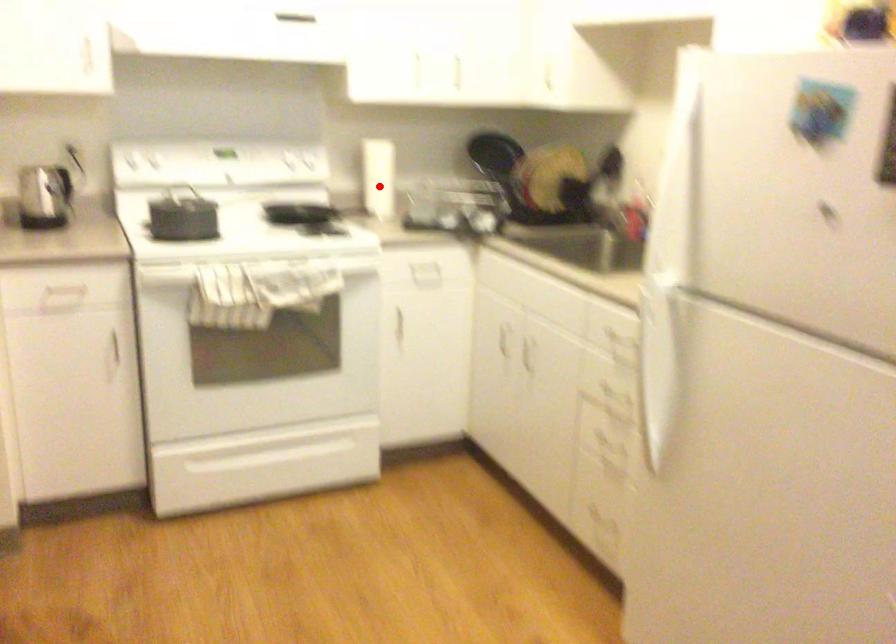
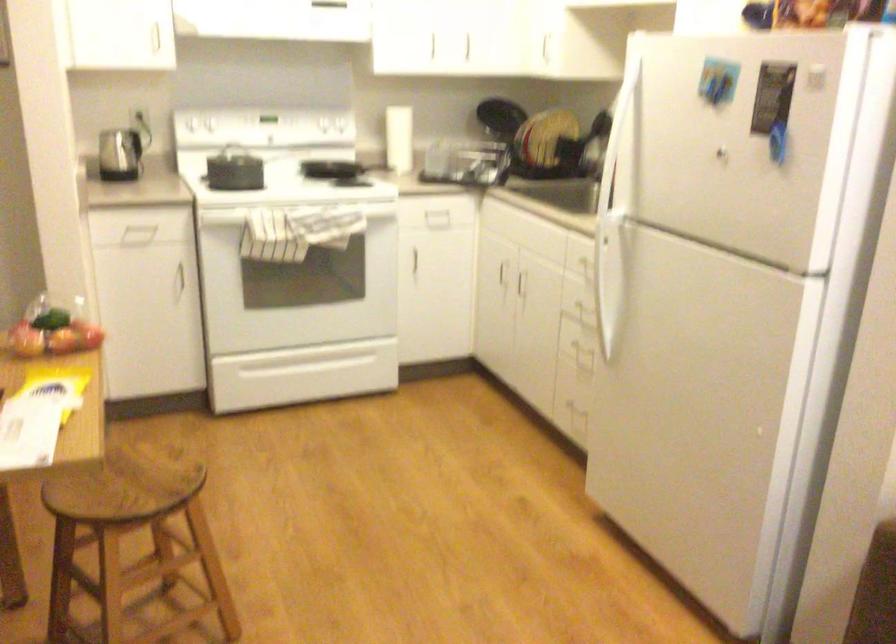
Question: I am providing you with two images of the same scene from different viewpoints. A red point is shown in image1. For the corresponding object point in image2, is it positioned nearer or farther from the camera?

Choices:
 (A) Nearer
 (B) Farther

Answer: (B)